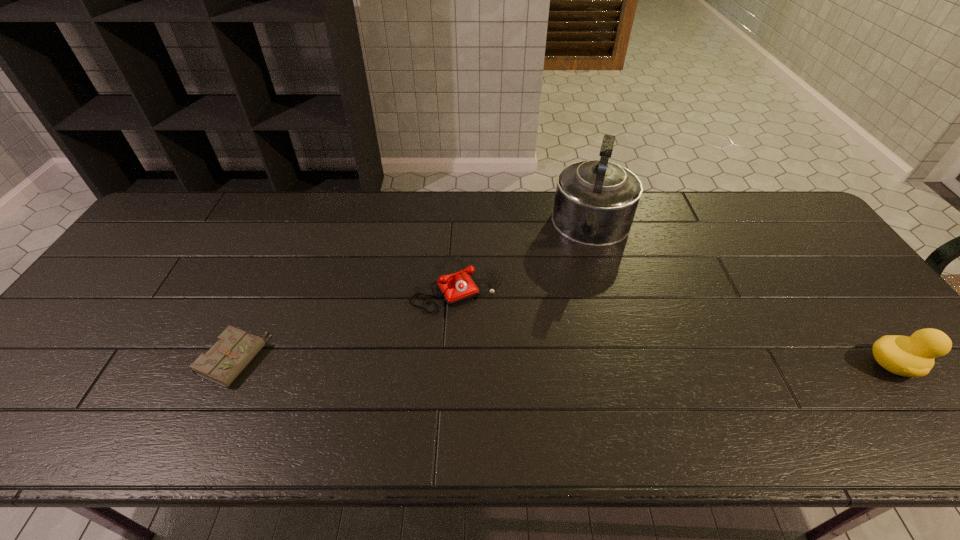
Find the location of `the shortest object`. the shortest object is located at coordinates (224, 361).

Locate an element on the screen. The image size is (960, 540). the leftmost object is located at coordinates (224, 361).

This screenshot has height=540, width=960. In order to click on the rightmost object in this screenshot , I will do `click(913, 356)`.

Where is `duck`? This screenshot has width=960, height=540. duck is located at coordinates (913, 356).

You are a GUI agent. You are given a task and a screenshot of the screen. Output one action in this format:
    pyautogui.click(x=<x>, y=<y>)
    Task: Click on the tallest object
    
    Given the screenshot: What is the action you would take?
    pyautogui.click(x=595, y=202)

Where is `kettle`? This screenshot has width=960, height=540. kettle is located at coordinates (595, 202).

Where is `telephone`? This screenshot has width=960, height=540. telephone is located at coordinates (455, 288).

Locate an element on the screen. the second object from left to right is located at coordinates (455, 288).

Where is `vacant space located 0.170m on the left of the leftmost object`? The image size is (960, 540). vacant space located 0.170m on the left of the leftmost object is located at coordinates (132, 360).

The image size is (960, 540). I want to click on free point located 0.070m with the spout at the front of the kettle, so click(x=586, y=278).